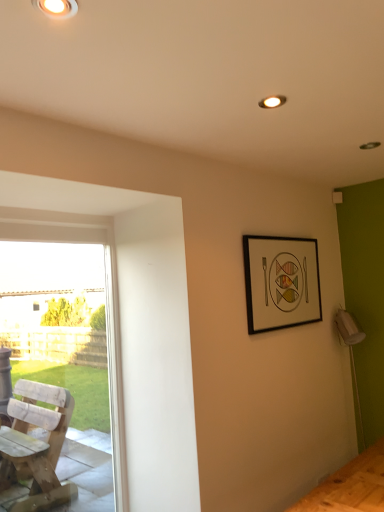
Question: Does point (314, 313) appear closer or farther from the camera than point (122, 395)?

Choices:
 (A) farther
 (B) closer

Answer: (A)

Question: Is black matte picture frame at upper right wider or thinner than wooden chair at left?

Choices:
 (A) thin
 (B) wide

Answer: (A)

Question: Which object is positioned farthest from the wooden chair at left?

Choices:
 (A) black matte picture frame at upper right
 (B) matte white ceiling light at upper left

Answer: (B)

Question: Which is farther from the matte white ceiling light at upper left?

Choices:
 (A) black matte picture frame at upper right
 (B) wooden chair at left

Answer: (A)